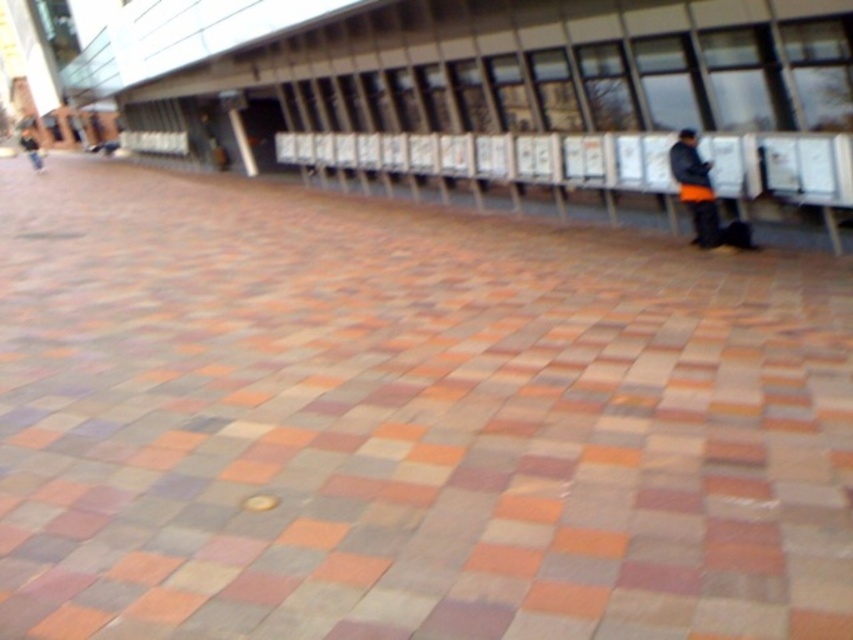
You are a photographer trying to capture both the orange fabric jacket at right and the black matte jacket at right in a single frame. Based on their positions and sizes, which jacket should you focus on to ensure both are fully visible without cropping?

The orange fabric jacket at right might be wider than black matte jacket at right, so focusing on the orange fabric jacket at right would ensure both are fully visible as it may require more space in the frame.